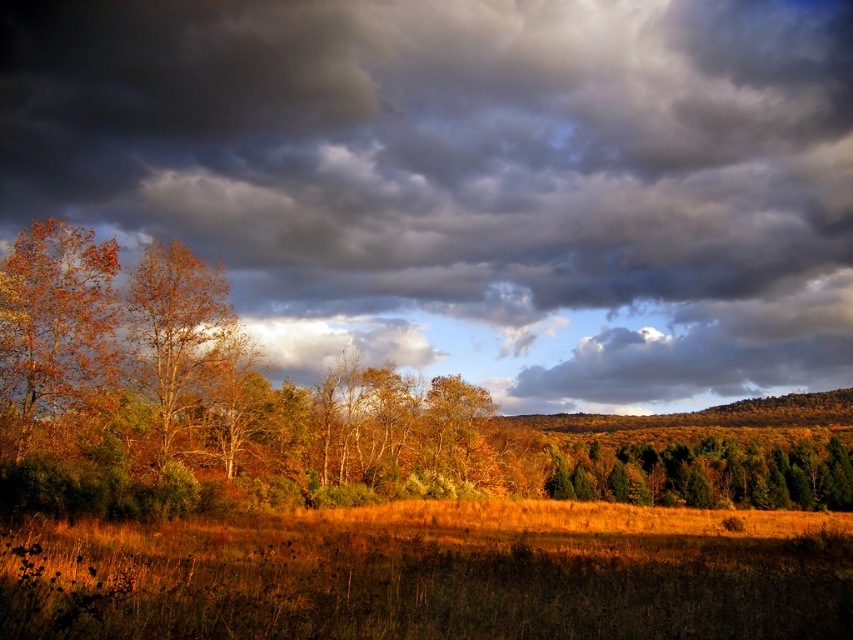
You are standing in the autumn landscape and want to walk from the point at coordinates point (751, 324) to the point at coordinates point (660, 634). Which direction should you move to reach your destination?

To reach point (660, 634) from point (751, 324), you should move towards the upper right direction since point (660, 634) is in front of point (751, 324).

You are standing in the autumn landscape and want to walk towards the green matte trees at center and the orange matte tree at left. Which tree will you reach first?

You will reach the green matte trees at center first because they are closer to you than the orange matte tree at left, which is further away.

You are standing in the autumn field and want to know if the dark gray cloud at upper center is taller than the golden grass at lower center. Can you confirm this?

The dark gray cloud at upper center is much taller than the golden grass at lower center, so yes, it is taller.